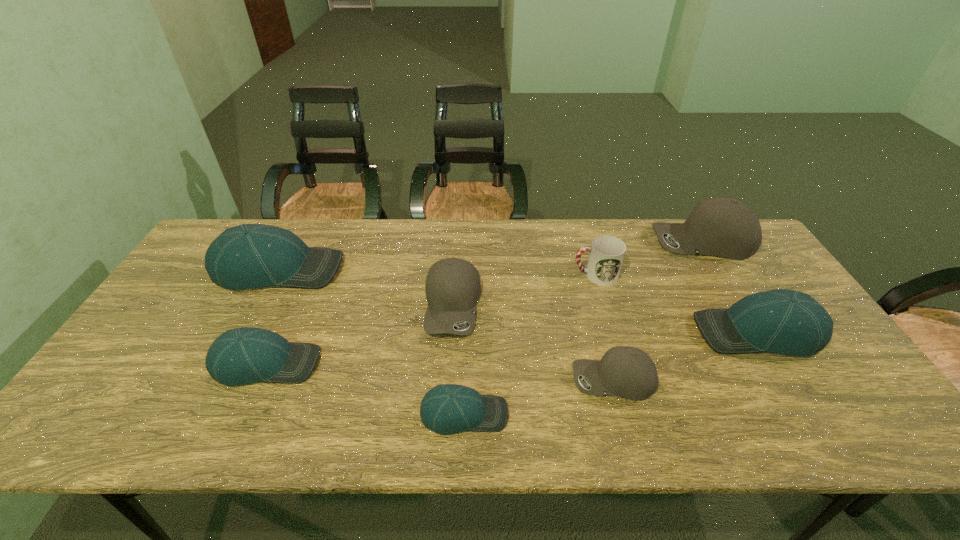
Locate an element on the screen. Image resolution: width=960 pixels, height=540 pixels. the farthest gray baseball cap is located at coordinates (724, 227).

You are a GUI agent. You are given a task and a screenshot of the screen. Output one action in this format:
    pyautogui.click(x=<x>, y=<y>)
    Task: Click on the rightmost gray baseball cap
    Image resolution: width=960 pixels, height=540 pixels.
    Given the screenshot: What is the action you would take?
    pyautogui.click(x=724, y=227)

What are the coordinates of `the farthest light baseball cap` in the screenshot? It's located at (247, 256).

Locate an element on the screen. The height and width of the screenshot is (540, 960). the second smallest gray baseball cap is located at coordinates (452, 287).

At what (x,y) coordinates should I click in order to perform the action: click on the leftmost gray baseball cap. Please return your answer as a coordinate pair (x, y). The height and width of the screenshot is (540, 960). Looking at the image, I should click on (452, 287).

At what (x,y) coordinates should I click in order to perform the action: click on the second biggest light baseball cap. Please return your answer as a coordinate pair (x, y). Looking at the image, I should click on (783, 321).

This screenshot has height=540, width=960. In order to click on cup in this screenshot , I will do `click(606, 256)`.

Locate an element on the screen. This screenshot has width=960, height=540. the second smallest light baseball cap is located at coordinates (244, 355).

Where is `the second gray baseball cap from left to right`? Image resolution: width=960 pixels, height=540 pixels. the second gray baseball cap from left to right is located at coordinates (628, 372).

You are a GUI agent. You are given a task and a screenshot of the screen. Output one action in this format:
    pyautogui.click(x=<x>, y=<y>)
    Task: Click on the smallest gray baseball cap
    The image size is (960, 540).
    Given the screenshot: What is the action you would take?
    pyautogui.click(x=628, y=372)